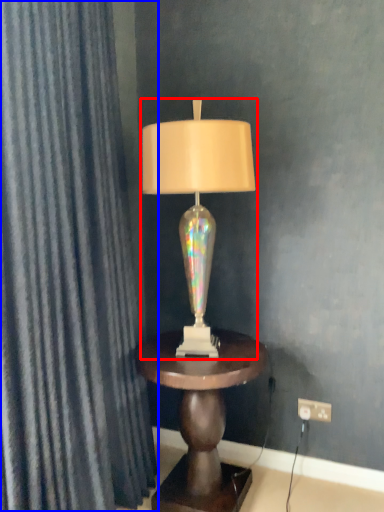
Question: Which object is closer to the camera taking this photo, lamp (highlighted by a red box) or curtain (highlighted by a blue box)?

Choices:
 (A) lamp
 (B) curtain

Answer: (B)